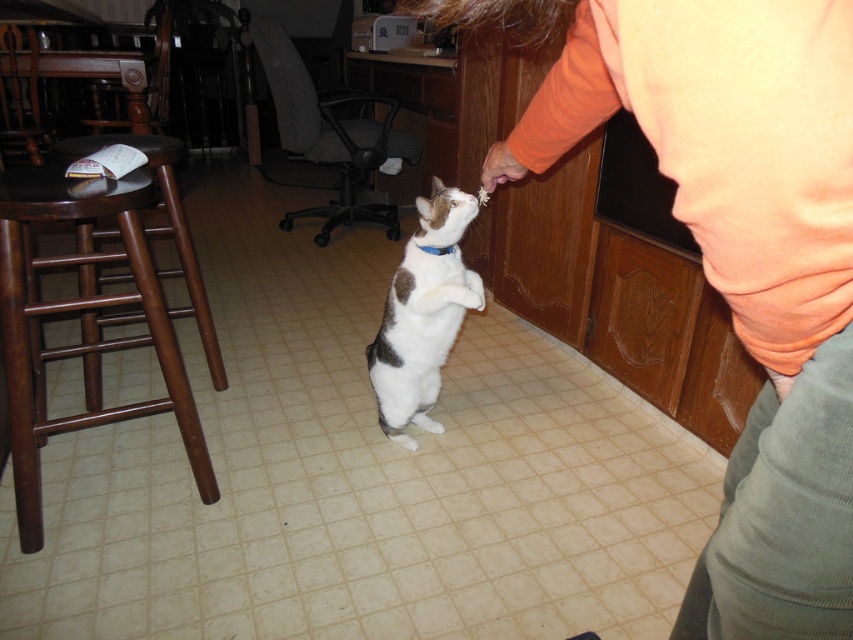
This screenshot has width=853, height=640. What do you see at coordinates (743, 266) in the screenshot?
I see `orange cotton shirt at upper right` at bounding box center [743, 266].

Can you confirm if orange cotton shirt at upper right is bigger than white fur with brown spots at center?

Yes, orange cotton shirt at upper right is bigger than white fur with brown spots at center.

Is point (550, 147) farther from viewer compared to point (439, 184)?

That is False.

Where is `orange cotton shirt at upper right`? orange cotton shirt at upper right is located at coordinates (743, 266).

Measure the distance between brown wood bar stool at left and camera.

brown wood bar stool at left and camera are 4.10 feet apart.

Between brown wood bar stool at left and white fur with brown spots at center, which one is positioned higher?

white fur with brown spots at center

Is point (90, 284) closer to camera compared to point (462, 205)?

No, it is not.

Where is `brown wood bar stool at left`? brown wood bar stool at left is located at coordinates (82, 321).

What do you see at coordinates (743, 266) in the screenshot?
I see `orange cotton shirt at upper right` at bounding box center [743, 266].

Can you confirm if orange cotton shirt at upper right is smaller than blue fabric neckband at center?

No, orange cotton shirt at upper right is not smaller than blue fabric neckband at center.

Describe the element at coordinates (743, 266) in the screenshot. The height and width of the screenshot is (640, 853). I see `orange cotton shirt at upper right` at that location.

Locate an element on the screen. The width and height of the screenshot is (853, 640). orange cotton shirt at upper right is located at coordinates (743, 266).